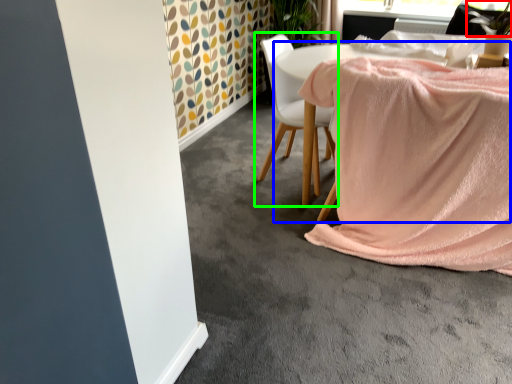
Question: Which is nearer to the plant (highlighted by a red box)? table (highlighted by a blue box) or chair (highlighted by a green box).

Choices:
 (A) table
 (B) chair

Answer: (A)